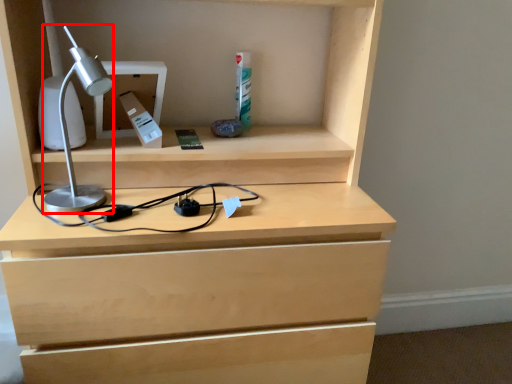
Question: From the image's perspective, what is the correct spatial positioning of lamp (annotated by the red box) in reference to cabinet?

Choices:
 (A) above
 (B) below

Answer: (B)